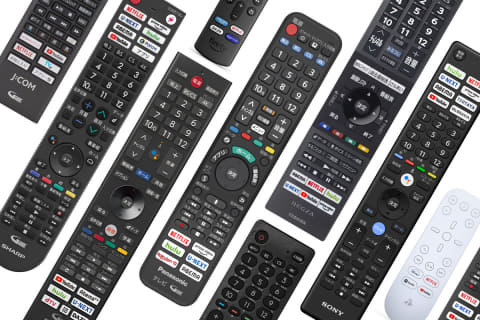
Locate an element on the screen. The height and width of the screenshot is (320, 480). remote controls is located at coordinates (41, 41), (96, 109), (222, 26), (154, 139), (247, 122), (389, 70), (268, 269), (384, 210), (439, 240), (466, 304).